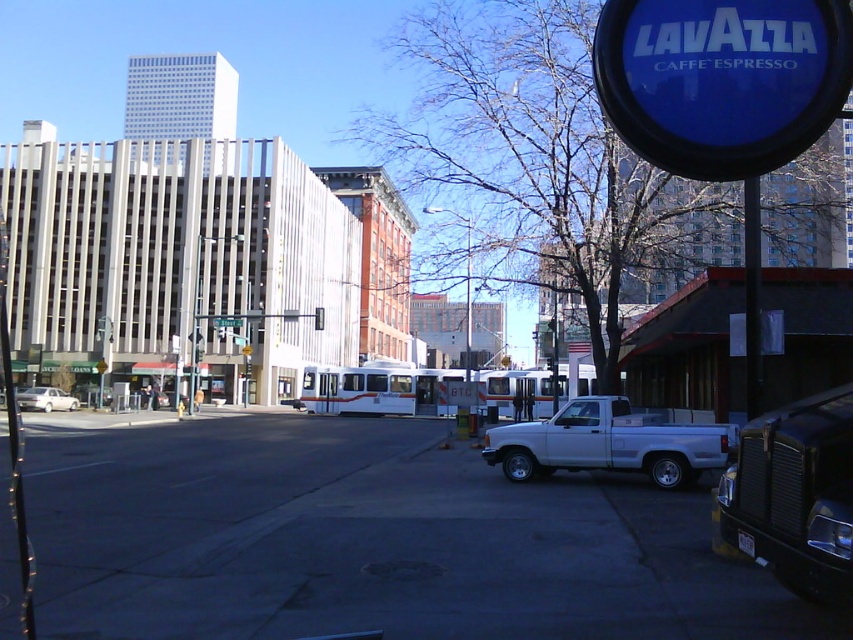
The image size is (853, 640). Find the location of `metallic pole at center`. metallic pole at center is located at coordinates (752, 292).

Who is positioned more to the left, metallic pole at center or white matte sedan at left?

Positioned to the left is white matte sedan at left.

What do you see at coordinates (752, 292) in the screenshot?
I see `metallic pole at center` at bounding box center [752, 292].

You are a GUI agent. You are given a task and a screenshot of the screen. Output one action in this format:
    pyautogui.click(x=<x>, y=<y>)
    Task: Click on the metallic pole at center
    The width and height of the screenshot is (853, 640).
    Given the screenshot: What is the action you would take?
    pyautogui.click(x=752, y=292)

Can you confirm if gray concrete pavement at center is positioned to the right of white matte sedan at left?

Yes, gray concrete pavement at center is to the right of white matte sedan at left.

Consider the image. Is gray concrete pavement at center closer to the viewer compared to white matte sedan at left?

Yes, it is.

Between point (328, 435) and point (33, 394), which one is positioned behind?

Positioned behind is point (33, 394).

Where is `gray concrete pavement at center`? gray concrete pavement at center is located at coordinates (368, 540).

Is white matte truck at lower right shorter than metallic pole at center?

Yes.

In the scene shown: Between white matte truck at lower right and metallic pole at center, which one appears on the right side from the viewer's perspective?

Positioned to the right is metallic pole at center.

Which is behind, point (564, 456) or point (758, 384)?

Positioned behind is point (564, 456).

In order to click on white matte truck at lower right in this screenshot , I will do `click(608, 444)`.